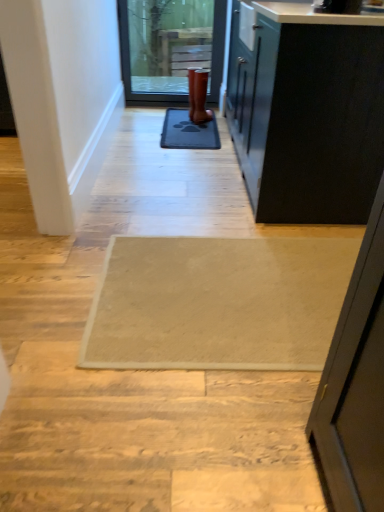
This screenshot has height=512, width=384. Describe the element at coordinates (36, 113) in the screenshot. I see `white smooth door at left` at that location.

Identify the location of beige textured rug at center. (218, 303).

Locate an element on the screen. white smooth door at left is located at coordinates (36, 113).

Which is closer to the camera, (42, 224) or (197, 54)?

Clearly, point (42, 224) is closer to the camera than point (197, 54).

From a real-world perspective, is white smooth door at left located beneath matte glass door at upper center?

No, from a real-world perspective, white smooth door at left is not under matte glass door at upper center.

Considering their positions, is white smooth door at left located in front of or behind matte glass door at upper center?

white smooth door at left is positioned closer to the viewer than matte glass door at upper center.

Can you tell me how much white smooth door at left and matte glass door at upper center differ in facing direction?

There is a 90.9-degree angle between the facing directions of white smooth door at left and matte glass door at upper center.

Between rubber boot at center and black rubber mat at center, which one has less height?

black rubber mat at center is shorter.

Does point (204, 100) come farther from viewer compared to point (209, 138)?

Yes.

From the image's perspective, is rubber boot at center on black rubber mat at center?

Indeed, from the image's perspective, rubber boot at center is shown above black rubber mat at center.

Is rubber boot at center wider than beige textured rug at center?

No.

Can you tell me how much rubber boot at center and beige textured rug at center differ in facing direction?

The angle between the facing direction of rubber boot at center and the facing direction of beige textured rug at center is 57.8 degrees.

Between point (201, 82) and point (181, 303), which one is positioned behind?

The point (201, 82) is farther from the camera.

Does rubber boot at center touch beige textured rug at center?

There is a gap between rubber boot at center and beige textured rug at center.

In the scene shown: Which is behind, beige textured rug at center or white smooth door at left?

beige textured rug at center is further away from the camera.

From the image's perspective, which one is positioned lower, beige textured rug at center or white smooth door at left?

beige textured rug at center.

Considering the sizes of beige textured rug at center and white smooth door at left in the image, is beige textured rug at center taller or shorter than white smooth door at left?

In the image, beige textured rug at center appears to be shorter than white smooth door at left.

Based on the photo, could white smooth door at left be considered to be inside beige textured rug at center?

No, white smooth door at left is not inside beige textured rug at center.

In the scene shown: Is rubber boot at center inside or outside of white smooth door at left?

rubber boot at center is spatially situated outside white smooth door at left.

Is rubber boot at center oriented towards white smooth door at left?

No, rubber boot at center is not oriented towards white smooth door at left.

Relative to white smooth door at left, is rubber boot at center in front or behind?

Visually, rubber boot at center is located behind white smooth door at left.

Can you confirm if rubber boot at center is smaller than white smooth door at left?

Yes, rubber boot at center is smaller than white smooth door at left.

From the image's perspective, between rubber boot at center and matte glass door at upper center, who is located below?

rubber boot at center appears lower in the image.

Considering the positions of points (193, 116) and (126, 54), is point (193, 116) farther from camera compared to point (126, 54)?

No, (193, 116) is closer to viewer.

Choose the correct answer: Is rubber boot at center inside matte glass door at upper center or outside it?

rubber boot at center is not enclosed by matte glass door at upper center.

Consider the image. From a real-world perspective, is rubber boot at center under matte glass door at upper center?

Result: Correct, in the physical world, rubber boot at center is lower than matte glass door at upper center.

How many degrees apart are the facing directions of black rubber mat at center and rubber boot at center?

The angular difference between black rubber mat at center and rubber boot at center is 31.6 degrees.

Which of these two, black rubber mat at center or rubber boot at center, is wider?

With larger width is black rubber mat at center.

Consider the image. Considering their positions, is black rubber mat at center located in front of or behind rubber boot at center?

In the image, black rubber mat at center appears in front of rubber boot at center.

Locate an element on the screen. pillar that is below the matte glass door at upper center (from the image's perspective) is located at coordinates (36, 113).

Find the location of `boot that is on the right side of black rubber mat at center`. boot that is on the right side of black rubber mat at center is located at coordinates (198, 95).

Considering their positions, is white smooth door at left positioned closer to matte glass door at upper center than rubber boot at center?

rubber boot at center.

From the image, which object appears to be nearer to beige textured rug at center, rubber boot at center or matte glass door at upper center?

rubber boot at center is closer to beige textured rug at center.

Estimate the real-world distances between objects in this image. Which object is further from white smooth door at left, rubber boot at center or beige textured rug at center?

rubber boot at center is positioned further to the anchor white smooth door at left.

Looking at the image, which one is located further to beige textured rug at center, black rubber mat at center or white smooth door at left?

black rubber mat at center is positioned further to the anchor beige textured rug at center.

In the scene shown: Looking at the image, which one is located closer to rubber boot at center, beige textured rug at center or white smooth door at left?

Among the two, white smooth door at left is located nearer to rubber boot at center.

Based on their spatial positions, is beige textured rug at center or matte glass door at upper center further from rubber boot at center?

Among the two, beige textured rug at center is located further to rubber boot at center.

From the image, which object appears to be nearer to beige textured rug at center, rubber boot at center or white smooth door at left?

white smooth door at left is positioned closer to the anchor beige textured rug at center.

From the image, which object appears to be nearer to matte glass door at upper center, beige textured rug at center or white smooth door at left?

white smooth door at left.

Identify the location of boot between white smooth door at left and matte glass door at upper center along the z-axis. This screenshot has width=384, height=512. pos(198,95).

At what (x,y) coordinates should I click in order to perform the action: click on mat positioned between beige textured rug at center and matte glass door at upper center from near to far. Please return your answer as a coordinate pair (x, y). Looking at the image, I should click on (188, 132).

Find the location of a particular element. mat positioned between white smooth door at left and rubber boot at center from near to far is located at coordinates (188, 132).

Find the location of `yoga mat between white smooth door at left and rubber boot at center in the front-back direction`. yoga mat between white smooth door at left and rubber boot at center in the front-back direction is located at coordinates (218, 303).